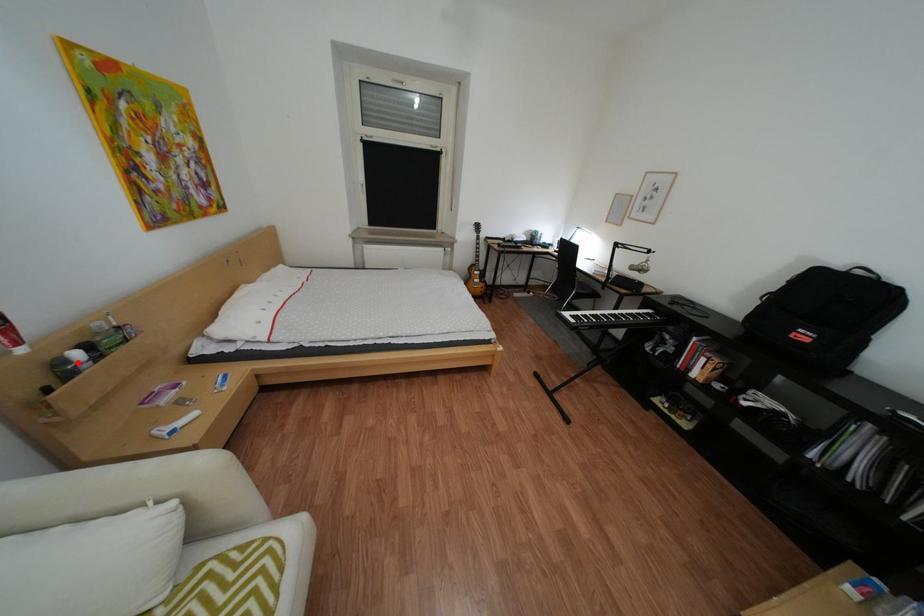
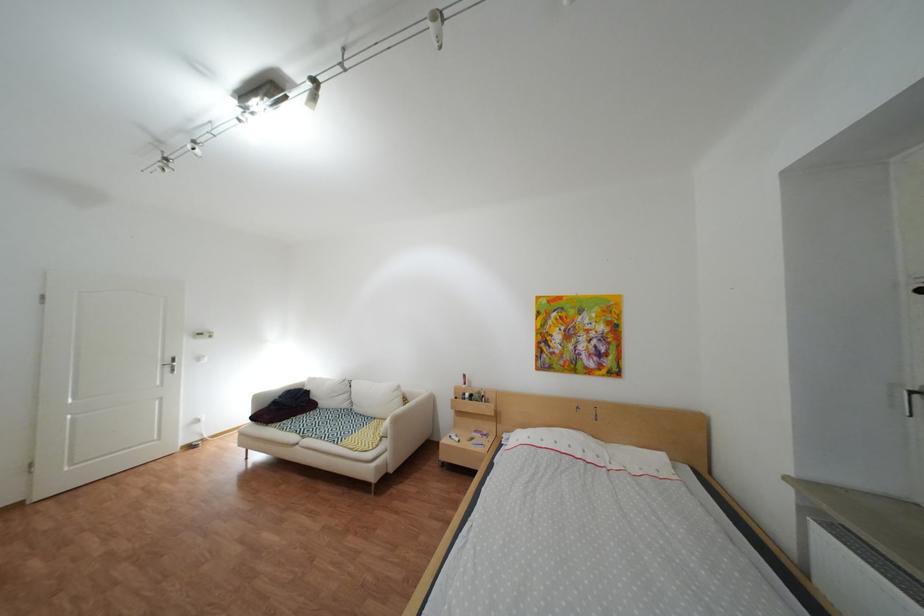
The point at the highlighted location is marked in the first image. Where is the corresponding point in the second image?

(480, 395)